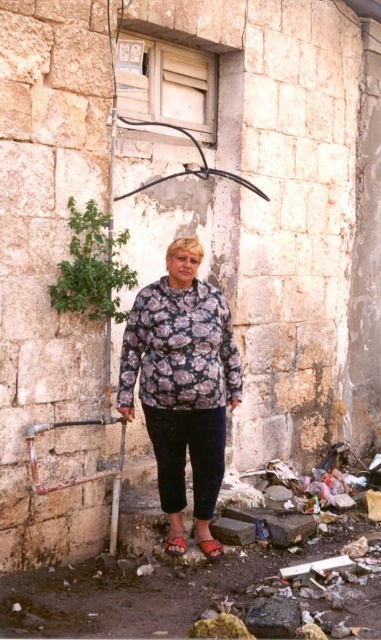
Is floral-patterned fabric at center wider than leather at right?

Indeed, floral-patterned fabric at center has a greater width compared to leather at right.

Is floral-patterned fabric at center above leather at right?

Yes.

Image resolution: width=381 pixels, height=640 pixels. What are the coordinates of `floral-patterned fabric at center` in the screenshot? It's located at (182, 380).

Where is `floral-patterned fabric at center`? This screenshot has width=381, height=640. floral-patterned fabric at center is located at coordinates (182, 380).

Is point (200, 540) positioned before point (176, 534)?

No, it is behind (176, 534).

I want to click on leather at right, so click(211, 547).

Does floral-patterned fabric at center appear over leather sandal at lower center?

Correct, floral-patterned fabric at center is located above leather sandal at lower center.

Can you confirm if floral-patterned fabric at center is bigger than leather sandal at lower center?

Correct, floral-patterned fabric at center is larger in size than leather sandal at lower center.

This screenshot has height=640, width=381. I want to click on floral-patterned fabric at center, so click(x=182, y=380).